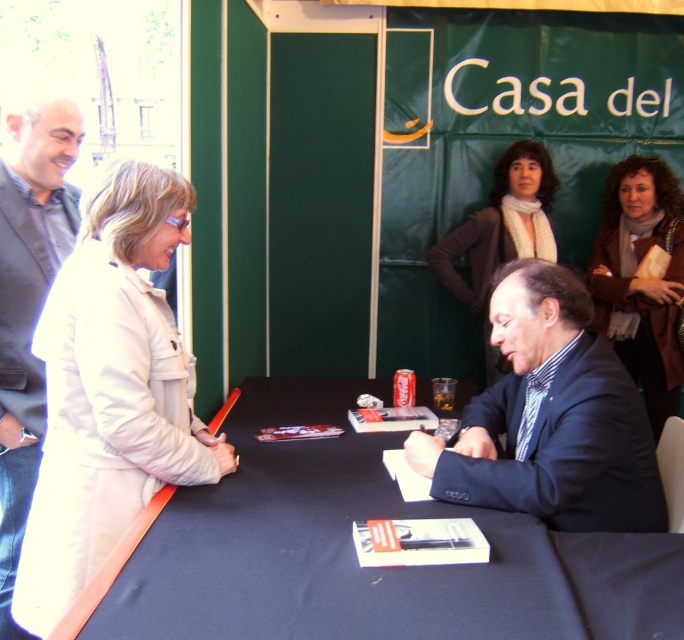
Question: Is dark blue fabric table at center behind brown leather jacket at upper right?

Choices:
 (A) yes
 (B) no

Answer: (B)

Question: Which object is positioned farthest from the dark blue shirt at left?

Choices:
 (A) brown leather jacket at upper center
 (B) beige fabric jacket at left
 (C) dark blue fabric table at center

Answer: (A)

Question: Which object is positioned closest to the brown leather jacket at upper right?

Choices:
 (A) dark blue fabric table at center
 (B) dark blue suit at center

Answer: (B)

Question: Does beige fabric jacket at left appear over dark blue suit at center?

Choices:
 (A) yes
 (B) no

Answer: (A)

Question: Based on their relative distances, which object is nearer to the brown leather jacket at upper right?

Choices:
 (A) dark blue shirt at left
 (B) beige fabric jacket at left

Answer: (B)

Question: Does dark blue suit at center appear on the left side of brown leather jacket at upper right?

Choices:
 (A) yes
 (B) no

Answer: (A)